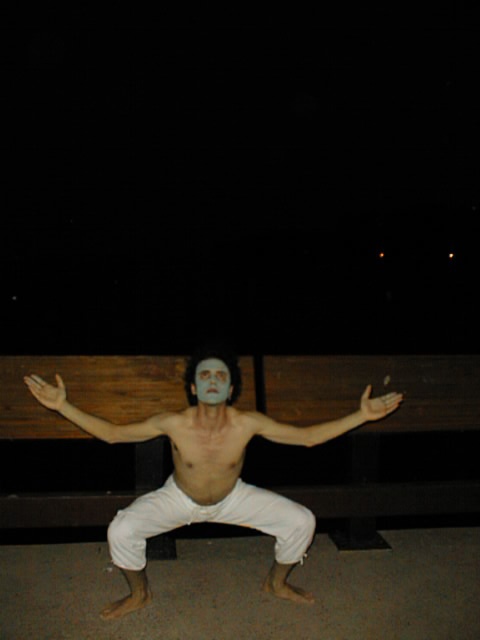
You are a photographer setting up a camera to capture the yoga pose. The camera requires the subject to be within a 20 cm focal range. Given the distance between the smooth skin torso at center and smooth matte face at center, will the camera be able to focus on both areas simultaneously?

The distance between the smooth skin torso at center and smooth matte face at center is 23.85 centimeters. Since the camera requires the subject to be within a 20 cm focal range, the camera cannot focus on both areas simultaneously because the distance exceeds the required range.